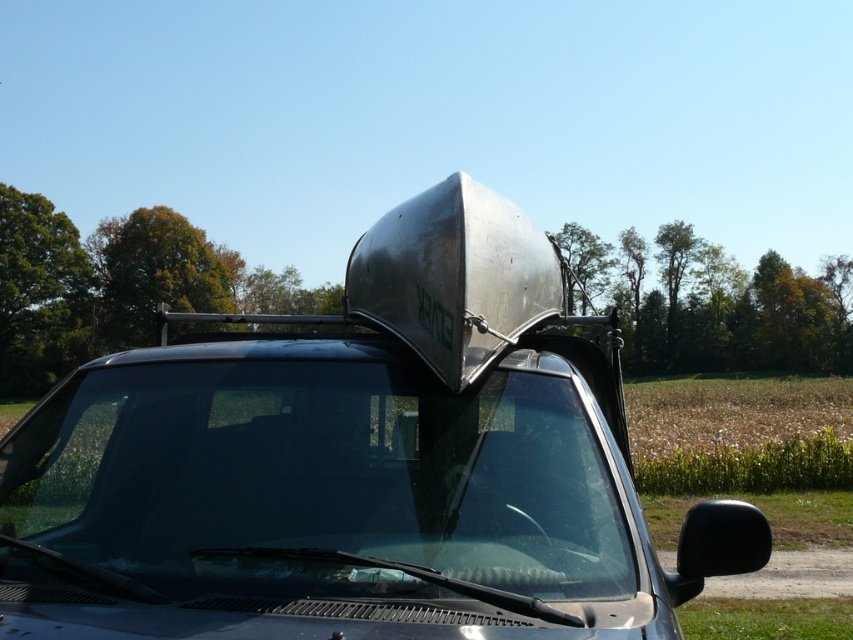
Question: Considering the real-world distances, which object is farthest from the metallic silver truck at center?

Choices:
 (A) transparent glass windshield at center
 (B) silver metallic hood at center

Answer: (B)

Question: Is metallic silver truck at center positioned at the back of silver metallic hood at center?

Choices:
 (A) no
 (B) yes

Answer: (A)

Question: Observing the image, what is the correct spatial positioning of metallic silver truck at center in reference to silver metallic hood at center?

Choices:
 (A) left
 (B) right

Answer: (A)

Question: Which object is the closest to the metallic silver truck at center?

Choices:
 (A) silver metallic hood at center
 (B) transparent glass windshield at center

Answer: (B)

Question: Which point appears closest to the camera in this image?

Choices:
 (A) (280, 483)
 (B) (440, 205)

Answer: (A)

Question: Is metallic silver truck at center positioned in front of silver metallic hood at center?

Choices:
 (A) no
 (B) yes

Answer: (B)